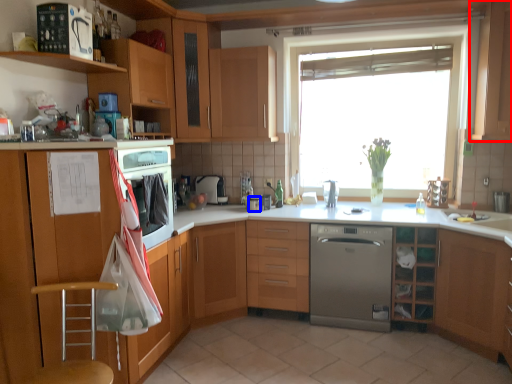
Question: Which object appears closest to the camera in this image, cabinetry (highlighted by a red box) or appliance (highlighted by a blue box)?

Choices:
 (A) cabinetry
 (B) appliance

Answer: (A)